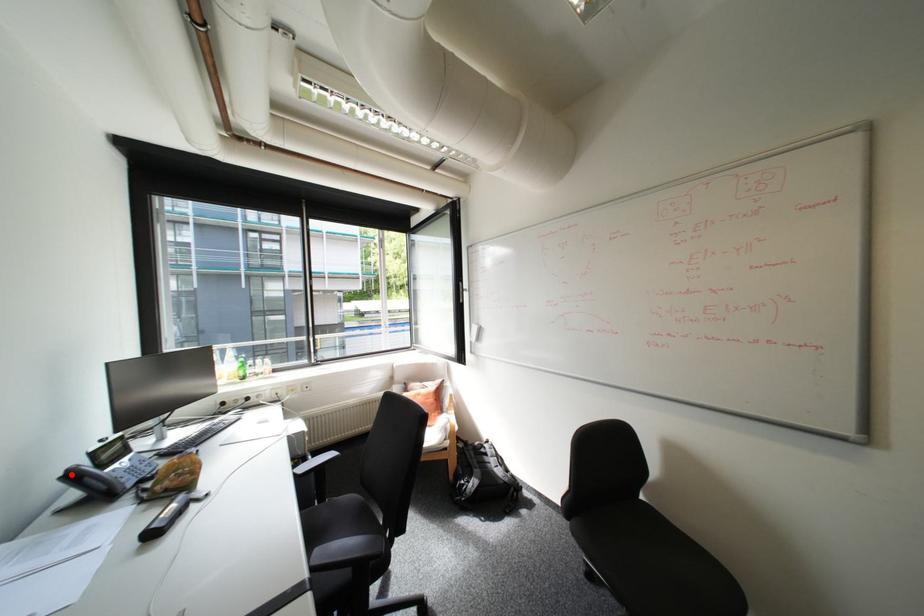
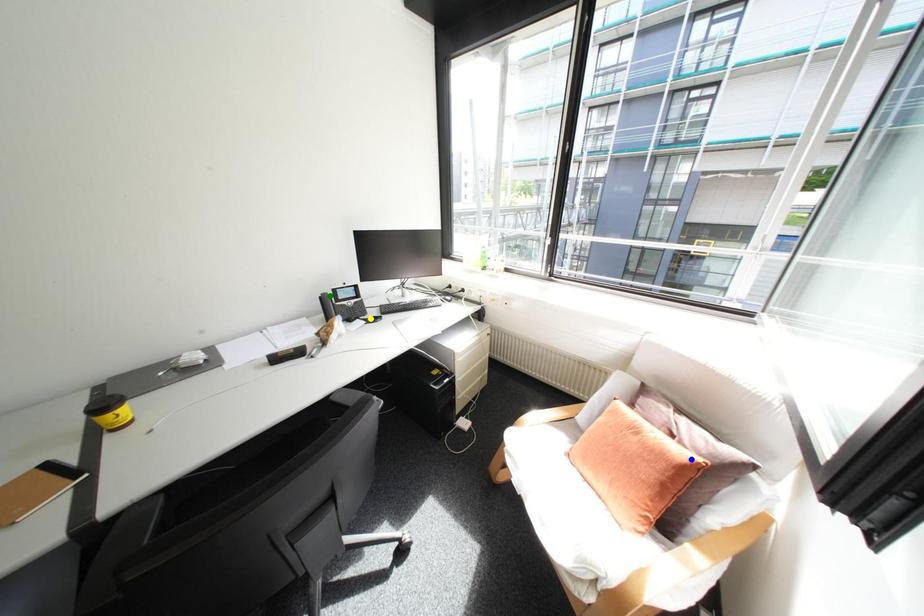
Question: I am providing you with two images of the same scene from different viewpoints. A red point is marked on the first image. You are given multiple points on the second image. Which mark in image 2 goes with the point in image 1?

Choices:
 (A) yellow point
 (B) blue point
 (C) green point

Answer: (C)